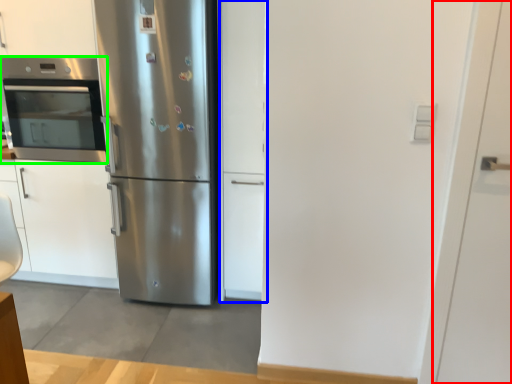
Question: Based on their relative distances, which object is nearer to door (highlighted by a red box)? Choose from door (highlighted by a blue box) and oven (highlighted by a green box).

Choices:
 (A) door
 (B) oven

Answer: (A)